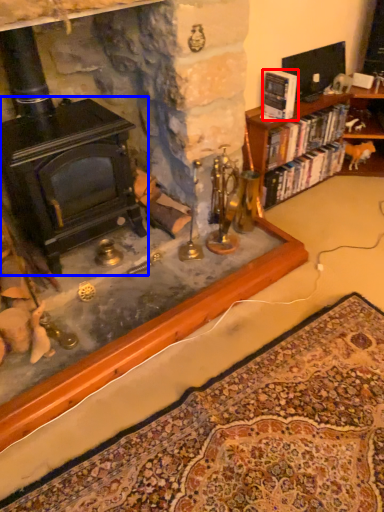
Question: Which point is closer to the camera, book (highlighted by a red box) or fireplace (highlighted by a blue box)?

Choices:
 (A) book
 (B) fireplace

Answer: (B)